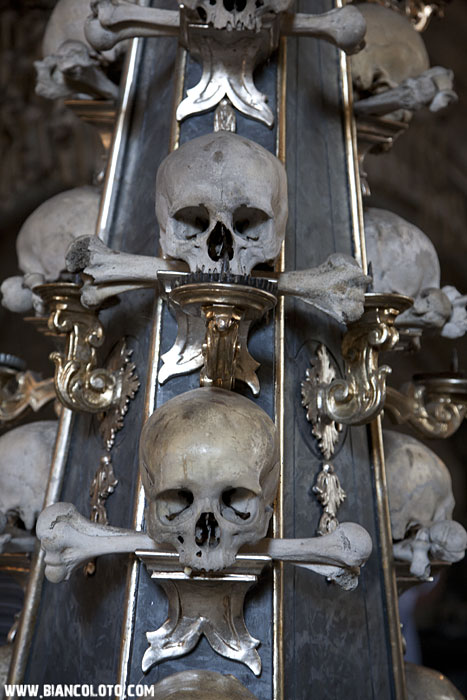
Where is `eye hole`? eye hole is located at coordinates (172, 500), (253, 508), (188, 227), (242, 223).